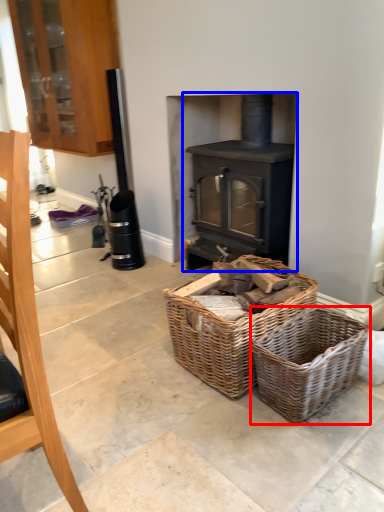
Question: Which object appears farthest to the camera in this image, basket (highlighted by a red box) or wood burning stove (highlighted by a blue box)?

Choices:
 (A) basket
 (B) wood burning stove

Answer: (B)